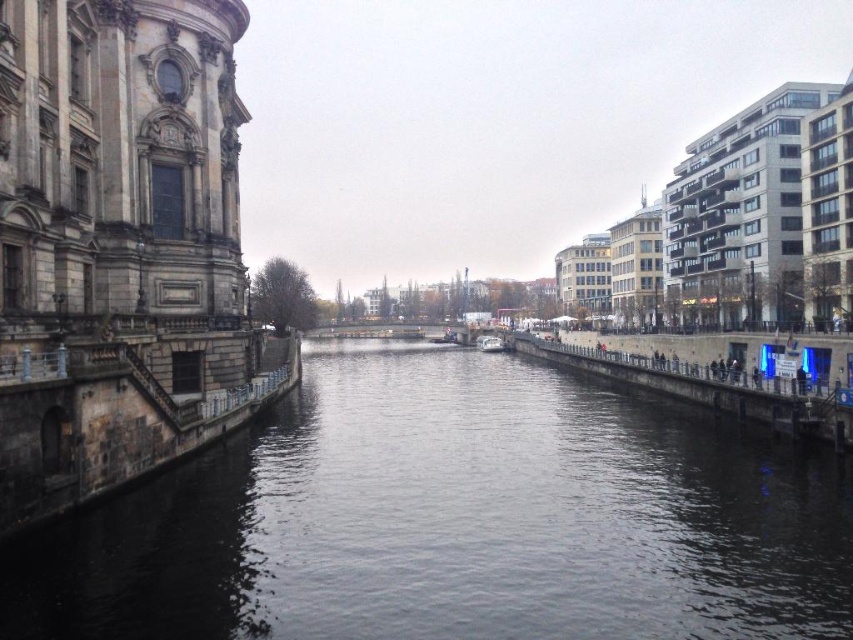
You are a photographer planning to capture the reflection of the historic building in the dark water at center. However, there is a white plastic boat at center in the way. Can you still take the photo without the boat appearing in the reflection?

The dark water at center is larger in size than white plastic boat at center. Since the water is bigger, you can position the camera to frame the reflection of the historic building while avoiding the boat by moving the camera angle slightly to one side of the dark water at center.

You are standing on the riverside and see the dark water at center and the white plastic boat at center. Which object is closer to you?

The dark water at center is closer to the viewer than the white plastic boat at center.